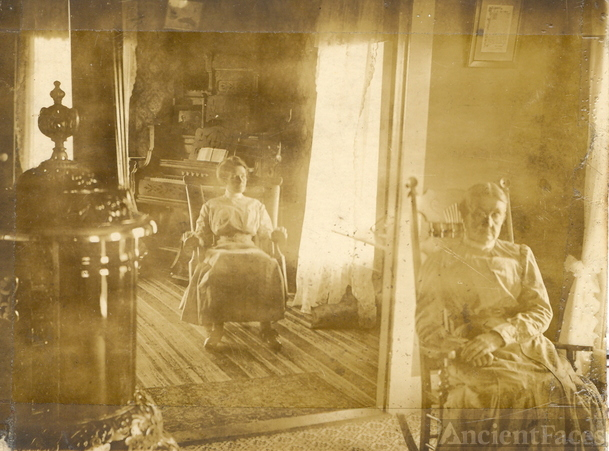
Locate an element on the screen. This screenshot has width=609, height=451. curtain is located at coordinates (122, 74), (19, 124), (597, 194).